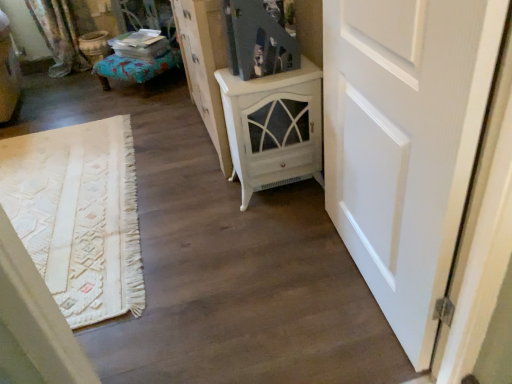
Question: Which is correct: white matte door at right is inside textured teal ottoman at left, or outside of it?

Choices:
 (A) inside
 (B) outside

Answer: (B)

Question: In terms of height, does white matte door at right look taller or shorter compared to textured teal ottoman at left?

Choices:
 (A) tall
 (B) short

Answer: (A)

Question: Considering the real-world distances, which object is closest to the white matte door at right?

Choices:
 (A) textured teal ottoman at left
 (B) white painted wood cabinet at center
 (C) white distressed cabinet at center

Answer: (B)

Question: Which of these objects is positioned closest to the white matte door at right?

Choices:
 (A) white distressed cabinet at center
 (B) textured teal ottoman at left
 (C) white painted wood cabinet at center

Answer: (C)